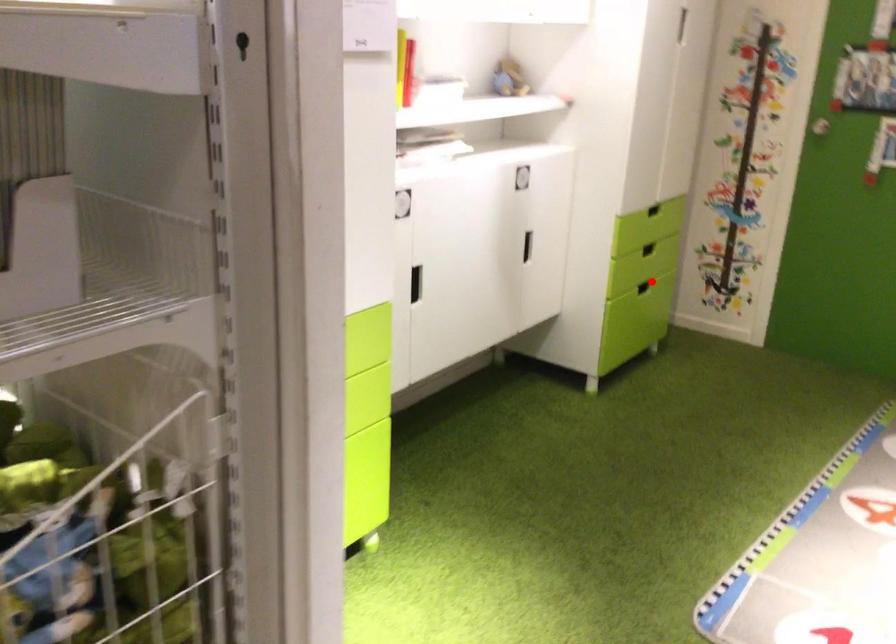
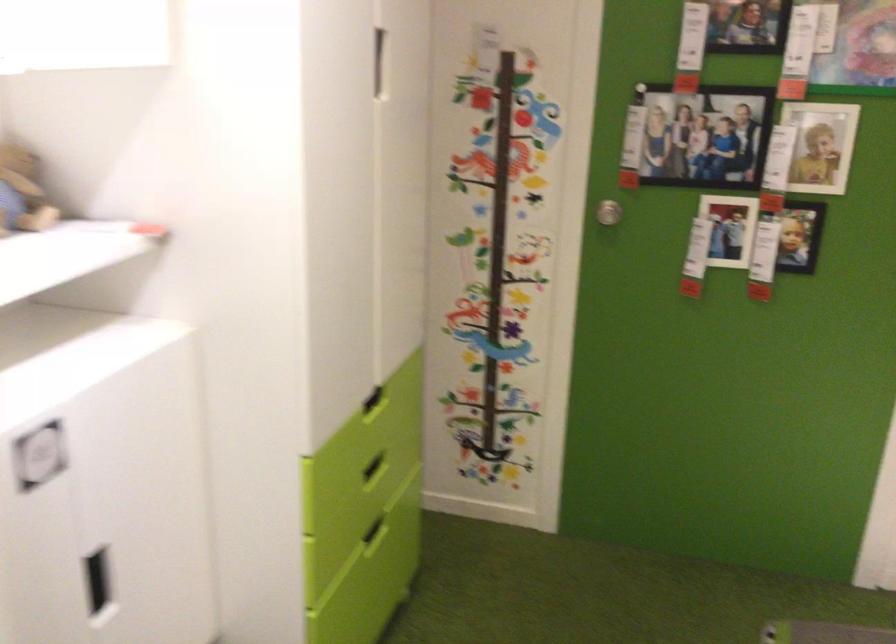
Find the pixel in the second image that matches the highlighted location in the first image.

(375, 531)